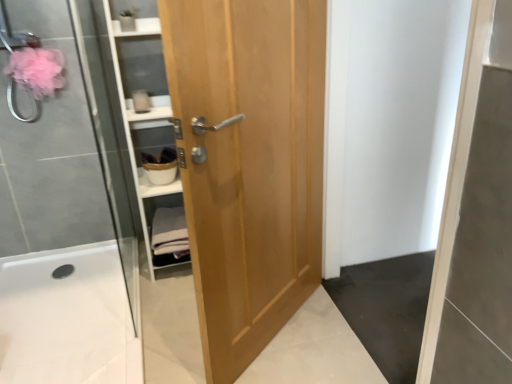
Measure the distance between point [172,91] and camera.

Point [172,91] and camera are 3.69 feet apart.

Find the location of a particular element. The image size is (512, 384). white cotton towels at center is located at coordinates (170, 232).

Is white glossy bath at lower left next to white cotton towels at center?

No, white glossy bath at lower left is not with white cotton towels at center.

Is white glossy bath at lower left facing away from white cotton towels at center?

white glossy bath at lower left is not turned away from white cotton towels at center.

Can you confirm if white glossy bath at lower left is taller than white cotton towels at center?

Incorrect, the height of white glossy bath at lower left is not larger of that of white cotton towels at center.

Is white glossy bath at lower left wider or thinner than white cotton towels at center?

Clearly, white glossy bath at lower left has more width compared to white cotton towels at center.

In the scene shown: How much distance is there between light brown wood door at center and white glossy bath at lower left?

35.96 inches.

From a real-world perspective, who is located higher, light brown wood door at center or white glossy bath at lower left?

light brown wood door at center is physically above.

In the image, is light brown wood door at center on the left side or the right side of white glossy bath at lower left?

Based on their positions, light brown wood door at center is located to the right of white glossy bath at lower left.

Is light brown wood door at center oriented towards white glossy bath at lower left?

No, light brown wood door at center is not oriented towards white glossy bath at lower left.

Which object is thinner, white cotton towels at center or light brown wood door at center?

Thinner between the two is light brown wood door at center.

Is light brown wood door at center a part of white cotton towels at center?

No, light brown wood door at center is not surrounded by white cotton towels at center.

Could you tell me if white cotton towels at center is turned towards light brown wood door at center?

Yes.

Which of these two, white cotton towels at center or white glossy bath at lower left, is thinner?

white cotton towels at center.

Considering the sizes of objects white cotton towels at center and white glossy bath at lower left in the image provided, who is smaller, white cotton towels at center or white glossy bath at lower left?

white cotton towels at center is smaller.

Is white cotton towels at center turned away from white glossy bath at lower left?

That's not correct — white cotton towels at center is not looking away from white glossy bath at lower left.

From a real-world perspective, who is located lower, white cotton towels at center or white glossy bath at lower left?

white glossy bath at lower left is physically lower.

Considering the sizes of objects light brown wood door at center and white cotton towels at center in the image provided, who is bigger, light brown wood door at center or white cotton towels at center?

light brown wood door at center.

Can you confirm if light brown wood door at center is taller than white cotton towels at center?

Yes.

Is white cotton towels at center at the back of light brown wood door at center?

Absolutely, light brown wood door at center is directed away from white cotton towels at center.

How different are the orientations of white glossy bath at lower left and light brown wood door at center in degrees?

white glossy bath at lower left and light brown wood door at center are facing 38.9 degrees away from each other.

Which object is positioned more to the right, white glossy bath at lower left or light brown wood door at center?

light brown wood door at center.

Who is bigger, white glossy bath at lower left or light brown wood door at center?

Bigger between the two is light brown wood door at center.

Looking at their sizes, would you say white glossy bath at lower left is wider or thinner than light brown wood door at center?

In the image, white glossy bath at lower left appears to be wider than light brown wood door at center.

This screenshot has height=384, width=512. In order to click on bath below the white cotton towels at center (from the image's perspective) in this screenshot , I will do tap(67, 319).

The image size is (512, 384). I want to click on door in front of the white glossy bath at lower left, so click(x=248, y=163).

From the image, which object appears to be nearer to light brown wood door at center, white glossy bath at lower left or white cotton towels at center?

white cotton towels at center is closer to light brown wood door at center.

Looking at this image, when comparing their distances from white glossy bath at lower left, does light brown wood door at center or white cotton towels at center seem further?

light brown wood door at center.

Estimate the real-world distances between objects in this image. Which object is closer to white cotton towels at center, white glossy bath at lower left or light brown wood door at center?

white glossy bath at lower left lies closer to white cotton towels at center than the other object.

In the scene shown: Which object lies further to the anchor point white glossy bath at lower left, white cotton towels at center or light brown wood door at center?

The object further to white glossy bath at lower left is light brown wood door at center.

Estimate the real-world distances between objects in this image. Which object is closer to light brown wood door at center, white cotton towels at center or white glossy bath at lower left?

white cotton towels at center is closer to light brown wood door at center.

Which object lies nearer to the anchor point white cotton towels at center, light brown wood door at center or white glossy bath at lower left?

white glossy bath at lower left lies closer to white cotton towels at center than the other object.

Where is `bath positioned between light brown wood door at center and white cotton towels at center from near to far`? bath positioned between light brown wood door at center and white cotton towels at center from near to far is located at coordinates (67, 319).